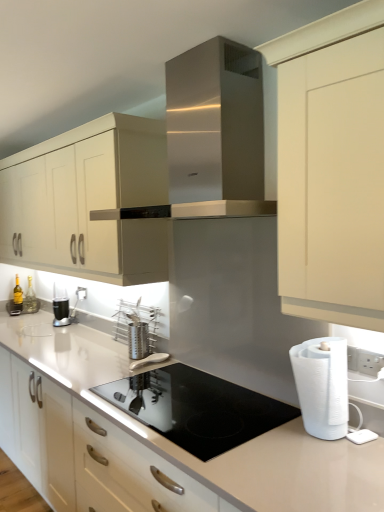
What is the approximate height of white plastic electric outlet at upper right?

9.10 centimeters.

What do you see at coordinates (18, 294) in the screenshot?
I see `translucent glass bottle at left, placed as the 1th bottle when sorted from left to right` at bounding box center [18, 294].

At what (x,y) coordinates should I click in order to perform the action: click on translucent glass bottle at left, the second bottle in the left-to-right sequence. Please return your answer as a coordinate pair (x, y). The image size is (384, 512). Looking at the image, I should click on (30, 291).

You are a GUI agent. You are given a task and a screenshot of the screen. Output one action in this format:
    pyautogui.click(x=<x>, y=<y>)
    Task: Click on the black glass gas stove at center
    The height and width of the screenshot is (512, 384).
    Given the screenshot: What is the action you would take?
    pyautogui.click(x=196, y=408)

From the image's perspective, is translucent glass bottle at left, the second bottle in the left-to-right sequence, located beneath translucent glass bottle at left, acting as the second bottle starting from the right?

Incorrect, from the image's perspective, translucent glass bottle at left, the second bottle in the left-to-right sequence, is higher than translucent glass bottle at left, acting as the second bottle starting from the right.

From a real-world perspective, who is located higher, translucent glass bottle at left, the first bottle in the right-to-left sequence, or translucent glass bottle at left, acting as the second bottle starting from the right?

In real-world perspective, translucent glass bottle at left, acting as the second bottle starting from the right, is above.

Is translucent glass bottle at left, the second bottle in the left-to-right sequence, shorter than translucent glass bottle at left, placed as the 1th bottle when sorted from left to right?

Yes, translucent glass bottle at left, the second bottle in the left-to-right sequence, is shorter than translucent glass bottle at left, placed as the 1th bottle when sorted from left to right.

Can you confirm if translucent glass bottle at left, the first bottle in the right-to-left sequence, is wider than translucent glass bottle at left, acting as the second bottle starting from the right?

No, translucent glass bottle at left, the first bottle in the right-to-left sequence, is not wider than translucent glass bottle at left, acting as the second bottle starting from the right.

Considering the sizes of translucent glass bottle at left, the second bottle in the left-to-right sequence, and white glossy countertop at center in the image, is translucent glass bottle at left, the second bottle in the left-to-right sequence, wider or thinner than white glossy countertop at center?

translucent glass bottle at left, the second bottle in the left-to-right sequence, is thinner than white glossy countertop at center.

From the image's perspective, is translucent glass bottle at left, the second bottle in the left-to-right sequence, below white glossy countertop at center?

No, from the image's perspective, translucent glass bottle at left, the second bottle in the left-to-right sequence, is not below white glossy countertop at center.

Is translucent glass bottle at left, the first bottle in the right-to-left sequence, smaller than white glossy countertop at center?

Yes.

How far apart are translucent glass bottle at left, acting as the second bottle starting from the right, and white glossy countertop at center?

translucent glass bottle at left, acting as the second bottle starting from the right, is 5.55 feet away from white glossy countertop at center.

Looking at their sizes, would you say translucent glass bottle at left, placed as the 1th bottle when sorted from left to right, is wider or thinner than white glossy countertop at center?

translucent glass bottle at left, placed as the 1th bottle when sorted from left to right, is thinner than white glossy countertop at center.

From the image's perspective, starting from the white glossy countertop at center, which bottle is the 1st one above? Please provide its 2D coordinates.

[(18, 294)]

Does translucent glass bottle at left, placed as the 1th bottle when sorted from left to right, have a smaller size compared to white glossy countertop at center?

Yes.

Considering the positions of objects matte white cabinet at upper center and stainless steel range hood at center in the image provided, who is more to the right, matte white cabinet at upper center or stainless steel range hood at center?

From the viewer's perspective, stainless steel range hood at center appears more on the right side.

How many degrees apart are the facing directions of matte white cabinet at upper center and stainless steel range hood at center?

There is a 0.362-degree angle between the facing directions of matte white cabinet at upper center and stainless steel range hood at center.

Could you tell me if matte white cabinet at upper center is turned towards stainless steel range hood at center?

No, matte white cabinet at upper center is not oriented towards stainless steel range hood at center.

In the scene shown: Is matte white cabinet at upper center not close to stainless steel range hood at center?

No, matte white cabinet at upper center is not far from stainless steel range hood at center.

Is translucent glass bottle at left, acting as the second bottle starting from the right, oriented away from black glass gas stove at center?

No.

Does translucent glass bottle at left, placed as the 1th bottle when sorted from left to right, contain black glass gas stove at center?

No, black glass gas stove at center is located outside of translucent glass bottle at left, placed as the 1th bottle when sorted from left to right.

Which object is closer to the camera, translucent glass bottle at left, acting as the second bottle starting from the right, or black glass gas stove at center?

black glass gas stove at center is closer to the camera.

Can you confirm if translucent glass bottle at left, acting as the second bottle starting from the right, is wider than black glass gas stove at center?

No, translucent glass bottle at left, acting as the second bottle starting from the right, is not wider than black glass gas stove at center.

Looking at this image, who is smaller, white plastic electric outlet at upper right or stainless steel range hood at center?

white plastic electric outlet at upper right.

Considering the sizes of objects white plastic electric outlet at upper right and stainless steel range hood at center in the image provided, who is thinner, white plastic electric outlet at upper right or stainless steel range hood at center?

white plastic electric outlet at upper right is thinner.

Considering the points (234, 418) and (67, 247), which point is in front, point (234, 418) or point (67, 247)?

The point (234, 418) is closer to the camera.

Based on the photo, considering the sizes of black glass gas stove at center and matte white cabinet at upper center in the image, is black glass gas stove at center taller or shorter than matte white cabinet at upper center?

Considering their sizes, black glass gas stove at center has less height than matte white cabinet at upper center.

Considering the sizes of objects black glass gas stove at center and matte white cabinet at upper center in the image provided, who is thinner, black glass gas stove at center or matte white cabinet at upper center?

matte white cabinet at upper center is thinner.

Is black glass gas stove at center not within matte white cabinet at upper center?

Indeed, black glass gas stove at center is completely outside matte white cabinet at upper center.

This screenshot has width=384, height=512. What are the coordinates of `bottle that appears behind the translucent glass bottle at left, placed as the 1th bottle when sorted from left to right` in the screenshot? It's located at (30, 291).

Image resolution: width=384 pixels, height=512 pixels. I want to click on bottle that is the 2nd object located above the white glossy countertop at center (from the image's perspective), so click(30, 291).

Which object lies further to the anchor point white plastic electric outlet at upper right, translucent glass bottle at left, the first bottle in the right-to-left sequence, or matte white cabinet at upper center?

The object further to white plastic electric outlet at upper right is matte white cabinet at upper center.

Estimate the real-world distances between objects in this image. Which object is closer to satin silver utensil holder at center, placed as the 1th appliance when sorted from bottom to top, matte white cabinet at upper center or black glass gas stove at center?

black glass gas stove at center lies closer to satin silver utensil holder at center, placed as the 1th appliance when sorted from bottom to top, than the other object.

In the scene shown: Considering their positions, is translucent glass bottle at left, the first bottle in the right-to-left sequence, positioned further to white glossy countertop at center than matte white cabinet at upper center?

Based on the image, translucent glass bottle at left, the first bottle in the right-to-left sequence, appears to be further to white glossy countertop at center.

From the image, which object appears to be farther from translucent glass bottle at left, the second bottle in the left-to-right sequence, white plastic electric outlet at upper right or white glossy countertop at center?

white glossy countertop at center is positioned further to the anchor translucent glass bottle at left, the second bottle in the left-to-right sequence.

Considering their positions, is translucent glass bottle at left, the second bottle in the left-to-right sequence, positioned closer to matte white cabinet at upper center than stainless steel utensil holder at center, which is the 2th appliance in bottom-to-top order?

stainless steel utensil holder at center, which is the 2th appliance in bottom-to-top order, is closer to matte white cabinet at upper center.

When comparing their distances from black glass gas stove at center, does translucent glass bottle at left, the second bottle in the left-to-right sequence, or white matte paper towel at right seem further?

translucent glass bottle at left, the second bottle in the left-to-right sequence, is further to black glass gas stove at center.

From the image, which object appears to be farther from black glass gas stove at center, translucent glass bottle at left, acting as the second bottle starting from the right, or matte white cabinet at upper center?

translucent glass bottle at left, acting as the second bottle starting from the right, is positioned further to the anchor black glass gas stove at center.

Estimate the real-world distances between objects in this image. Which object is closer to matte white cabinet at upper center, satin silver utensil holder at center, placed as the 1th appliance when sorted from bottom to top, or stainless steel utensil holder at center, which is the 2th appliance in bottom-to-top order?

stainless steel utensil holder at center, which is the 2th appliance in bottom-to-top order, is positioned closer to the anchor matte white cabinet at upper center.

In order to click on coffee machine located between translucent glass bottle at left, placed as the 1th bottle when sorted from left to right, and white plastic electric outlet at upper right in the left-right direction in this screenshot , I will do `click(66, 307)`.

The image size is (384, 512). Identify the location of paper towel between black glass gas stove at center and translucent glass bottle at left, the second bottle in the left-to-right sequence, from front to back. (322, 386).

Find the location of a particular element. This screenshot has width=384, height=512. cabinetry between white matte paper towel at right and translucent glass bottle at left, placed as the 1th bottle when sorted from left to right, in the front-back direction is located at coordinates (88, 201).

Find the location of a particular element. The image size is (384, 512). gas stove between white glossy countertop at center and stainless steel utensil holder at center, acting as the 1th appliance starting from the top, along the z-axis is located at coordinates (196, 408).